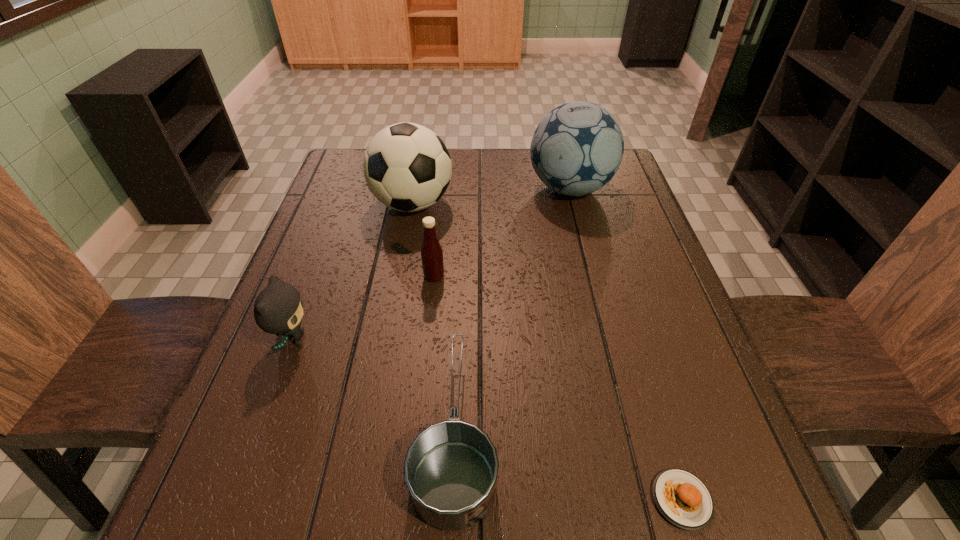
I want to click on object that ranks as the closest to the Tabasco sauce, so click(407, 167).

This screenshot has width=960, height=540. Identify the location of vacant point that satisfies the following two spatial constraints: 1. on the back side of the shortest object; 2. on the side with brand of the right soccer ball. (588, 188).

Identify the location of vacant area in the image that satisfies the following two spatial constraints: 1. on the back side of the shortest object; 2. on the front-facing side of the kitten. (633, 340).

The image size is (960, 540). I want to click on free region that satisfies the following two spatial constraints: 1. on the front-facing side of the kitten; 2. with the handle extending from one side of the fifth tallest object, so (x=260, y=430).

Identify the location of vacant space that satisfies the following two spatial constraints: 1. on the front-facing side of the shortest object; 2. on the right side of the leftmost object. The height and width of the screenshot is (540, 960). (x=234, y=500).